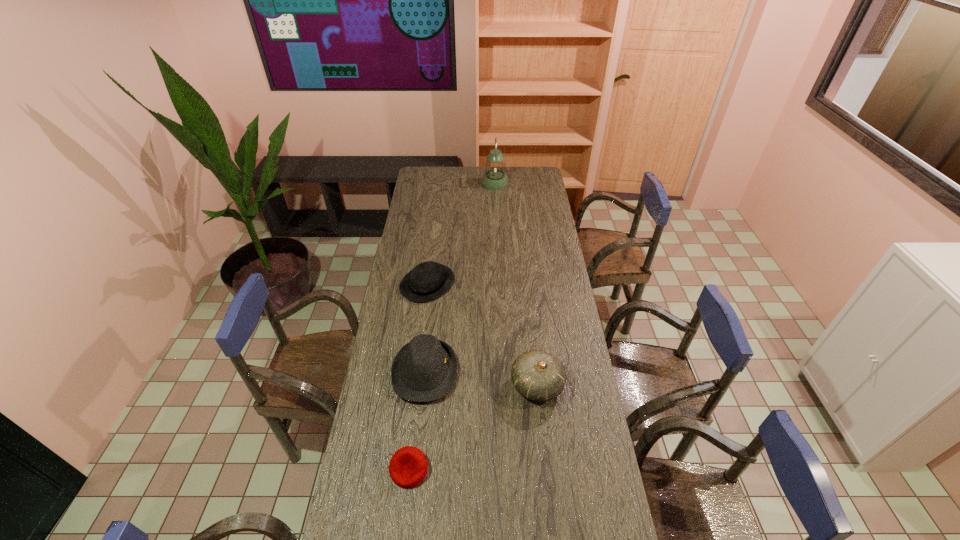
This screenshot has height=540, width=960. Find the location of `vacant region that satisfies the following two spatial constraints: 1. on the front-facing side of the nearer fedora; 2. on the seat area of the nearest object`. vacant region that satisfies the following two spatial constraints: 1. on the front-facing side of the nearer fedora; 2. on the seat area of the nearest object is located at coordinates (415, 469).